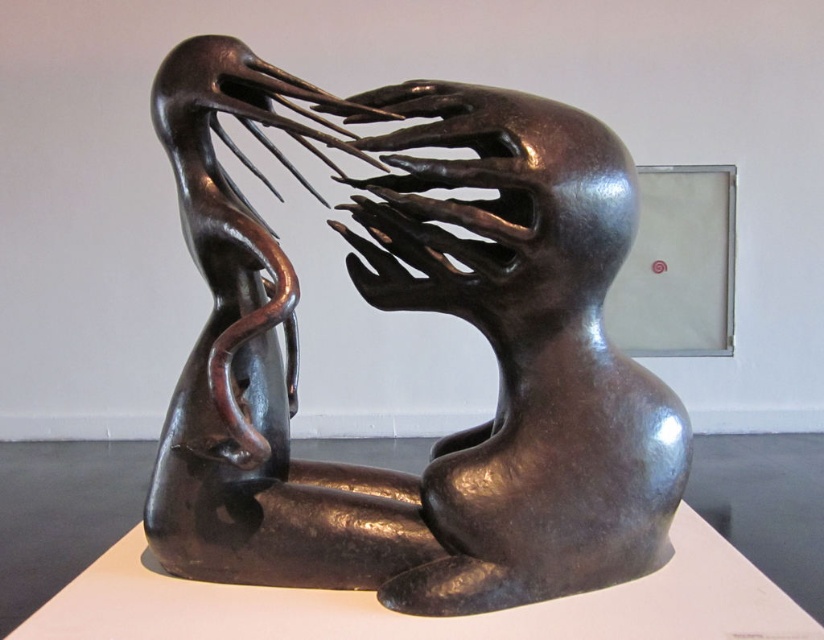
Looking at this image, who is higher up, shiny bronze sculpture at center or shiny metallic head at center?

shiny metallic head at center

Between shiny bronze sculpture at center and shiny metallic head at center, which one is positioned lower?

Positioned lower is shiny bronze sculpture at center.

Identify the location of shiny bronze sculpture at center. Image resolution: width=824 pixels, height=640 pixels. (415, 308).